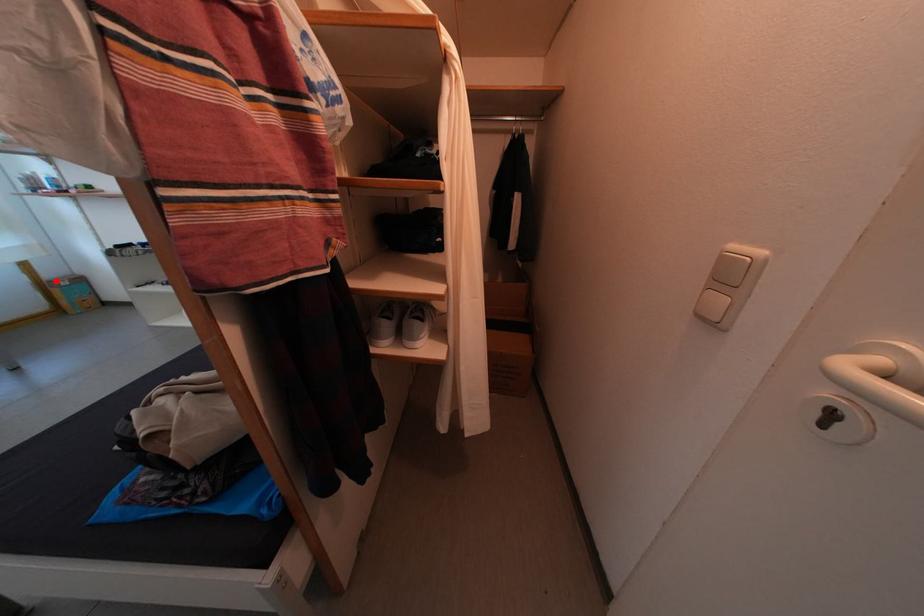
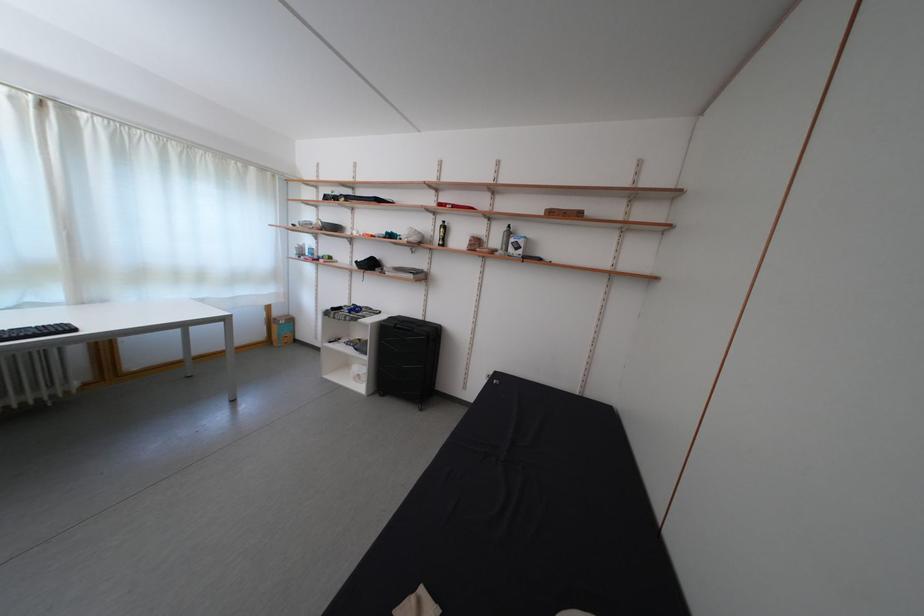
Find the pixel in the second image that matches the highlighted location in the first image.

(285, 320)